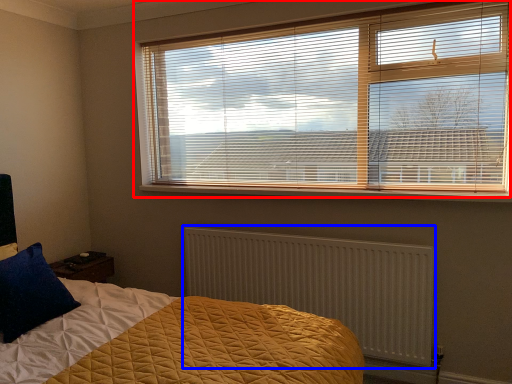
Question: Which object is closer to the camera taking this photo, window blind (highlighted by a red box) or radiator (highlighted by a blue box)?

Choices:
 (A) window blind
 (B) radiator

Answer: (A)